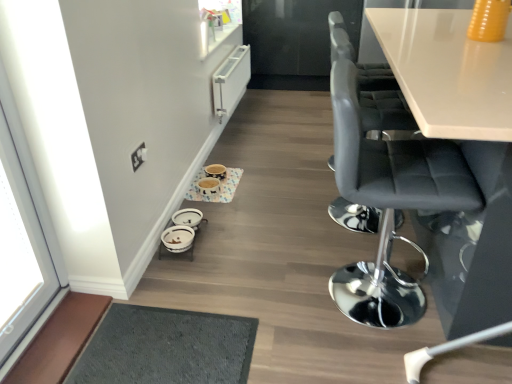
At what (x,y) coordinates should I click in order to perform the action: click on vacant space behind black leather stool at right, placed as the first chair when sorted from front to back. Please return your answer as a coordinate pair (x, y). This screenshot has width=512, height=384. Looking at the image, I should click on (343, 237).